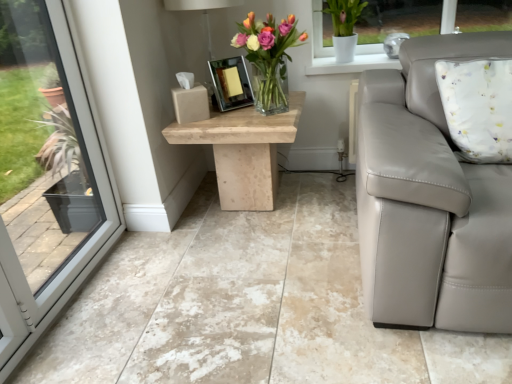
Question: From the image's perspective, would you say matte white lamp at upper center is shown under translucent glass vase at center?

Choices:
 (A) no
 (B) yes

Answer: (A)

Question: Would you say matte white lamp at upper center is a long distance from translucent glass vase at center?

Choices:
 (A) no
 (B) yes

Answer: (A)

Question: From the image's perspective, would you say matte white lamp at upper center is positioned over translucent glass vase at center?

Choices:
 (A) no
 (B) yes

Answer: (B)

Question: Considering the relative positions of matte white lamp at upper center and translucent glass vase at center in the image provided, is matte white lamp at upper center to the right of translucent glass vase at center from the viewer's perspective?

Choices:
 (A) no
 (B) yes

Answer: (A)

Question: Can you confirm if matte white lamp at upper center is bigger than translucent glass vase at center?

Choices:
 (A) no
 (B) yes

Answer: (B)

Question: Is matte white lamp at upper center situated inside translucent glass vase at center or outside?

Choices:
 (A) inside
 (B) outside

Answer: (B)

Question: Based on their positions, is matte white lamp at upper center located to the left or right of translucent glass vase at center?

Choices:
 (A) left
 (B) right

Answer: (A)

Question: From their relative heights in the image, would you say matte white lamp at upper center is taller or shorter than translucent glass vase at center?

Choices:
 (A) short
 (B) tall

Answer: (B)

Question: Considering the positions of point (170, 9) and point (283, 36), is point (170, 9) closer or farther from the camera than point (283, 36)?

Choices:
 (A) farther
 (B) closer

Answer: (A)

Question: Is matte white lamp at upper center in front of or behind beige marble floor at center in the image?

Choices:
 (A) behind
 (B) front

Answer: (A)

Question: From a real-world perspective, relative to beige marble floor at center, is matte white lamp at upper center vertically above or below?

Choices:
 (A) above
 (B) below

Answer: (A)

Question: Considering the positions of matte white lamp at upper center and beige marble floor at center in the image, is matte white lamp at upper center bigger or smaller than beige marble floor at center?

Choices:
 (A) small
 (B) big

Answer: (A)

Question: From the image's perspective, is matte white lamp at upper center located above or below beige marble floor at center?

Choices:
 (A) below
 (B) above

Answer: (B)

Question: In terms of width, does shiny silver picture frame at center look wider or thinner when compared to translucent glass vase at center?

Choices:
 (A) wide
 (B) thin

Answer: (B)

Question: From the image's perspective, relative to translucent glass vase at center, is shiny silver picture frame at center above or below?

Choices:
 (A) above
 (B) below

Answer: (B)